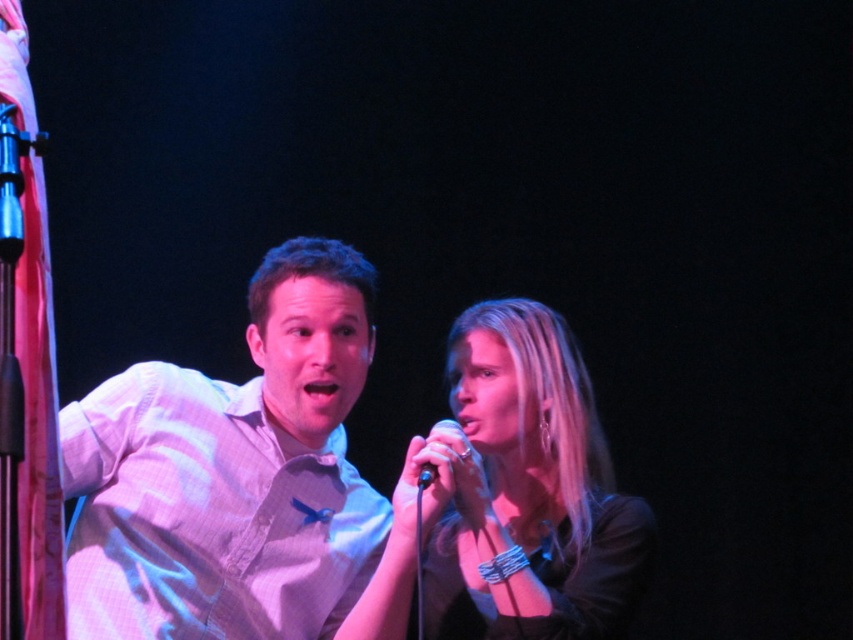
The height and width of the screenshot is (640, 853). Describe the element at coordinates (527, 492) in the screenshot. I see `smooth black shirt at center` at that location.

Where is `smooth black shirt at center`? This screenshot has width=853, height=640. smooth black shirt at center is located at coordinates (527, 492).

Who is more forward, (363, 333) or (544, 513)?

Point (363, 333)

Which is above, white checkered shirt at center or smooth black shirt at center?

white checkered shirt at center is above.

Which is in front, point (360, 573) or point (534, 358)?

Point (360, 573) is in front.

Locate an element on the screen. This screenshot has width=853, height=640. white checkered shirt at center is located at coordinates (231, 474).

Who is lower down, white checkered shirt at center or black metallic microphone at center?

white checkered shirt at center

Where is `white checkered shirt at center`? The height and width of the screenshot is (640, 853). white checkered shirt at center is located at coordinates click(x=231, y=474).